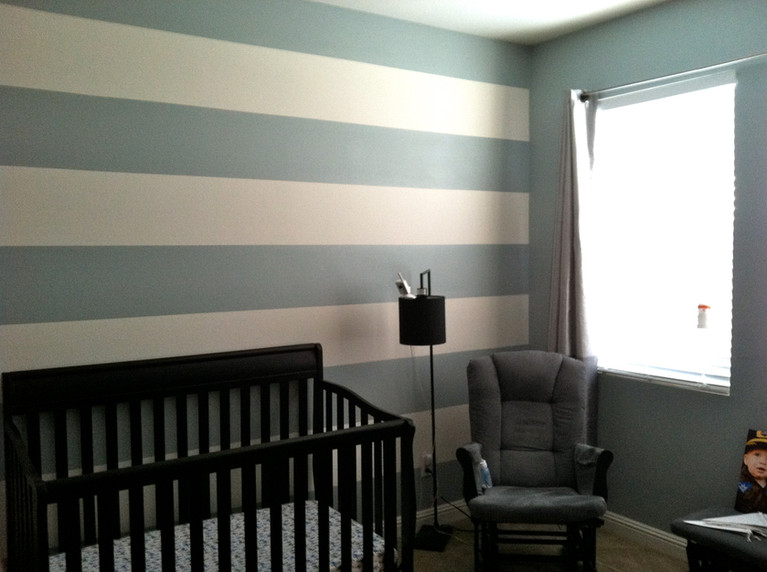
What are the coordinates of `book` in the screenshot? It's located at (729, 536).